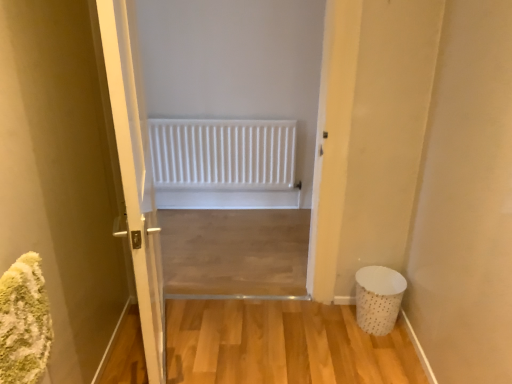
Question: Can you confirm if white dotted fabric laundry basket at lower right is bigger than white glossy door at center?

Choices:
 (A) no
 (B) yes

Answer: (A)

Question: Is white dotted fabric laundry basket at lower right closer to the viewer compared to white glossy door at center?

Choices:
 (A) yes
 (B) no

Answer: (B)

Question: From a real-world perspective, is white dotted fabric laundry basket at lower right located higher than white glossy door at center?

Choices:
 (A) no
 (B) yes

Answer: (A)

Question: Considering the relative sizes of white dotted fabric laundry basket at lower right and white glossy door at center in the image provided, is white dotted fabric laundry basket at lower right smaller than white glossy door at center?

Choices:
 (A) yes
 (B) no

Answer: (A)

Question: Is white dotted fabric laundry basket at lower right turned away from white glossy door at center?

Choices:
 (A) no
 (B) yes

Answer: (A)

Question: Is white dotted fabric laundry basket at lower right taller than white glossy door at center?

Choices:
 (A) no
 (B) yes

Answer: (A)

Question: Is the position of white dotted fabric laundry basket at lower right more distant than that of white matte radiator at center?

Choices:
 (A) no
 (B) yes

Answer: (A)

Question: From a real-world perspective, is white dotted fabric laundry basket at lower right over white matte radiator at center?

Choices:
 (A) no
 (B) yes

Answer: (A)

Question: Does white dotted fabric laundry basket at lower right have a greater width compared to white matte radiator at center?

Choices:
 (A) no
 (B) yes

Answer: (B)

Question: Is white dotted fabric laundry basket at lower right in front of white matte radiator at center?

Choices:
 (A) yes
 (B) no

Answer: (A)

Question: Does white dotted fabric laundry basket at lower right turn towards white matte radiator at center?

Choices:
 (A) yes
 (B) no

Answer: (B)

Question: Is white dotted fabric laundry basket at lower right at the left side of white matte radiator at center?

Choices:
 (A) yes
 (B) no

Answer: (B)

Question: From a real-world perspective, is white matte radiator at center positioned under white glossy door at center based on gravity?

Choices:
 (A) no
 (B) yes

Answer: (B)